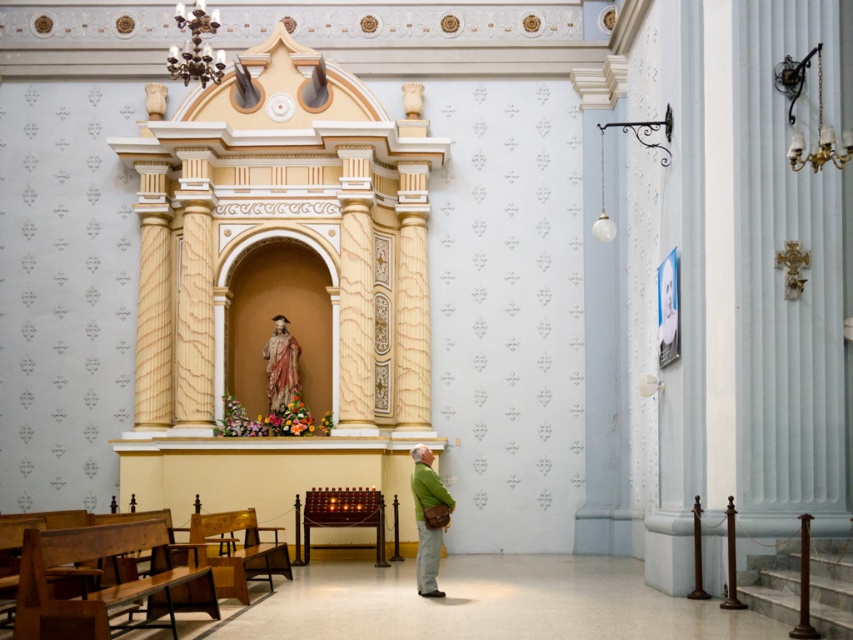
Question: Does wooden polished bench at lower left have a greater width compared to polychrome wood statue at center?

Choices:
 (A) yes
 (B) no

Answer: (A)

Question: Considering the relative positions of wooden polished bench at lower left and green fabric jacket at center in the image provided, where is wooden polished bench at lower left located with respect to green fabric jacket at center?

Choices:
 (A) left
 (B) right

Answer: (A)

Question: Which object is the closest to the green fabric jacket at center?

Choices:
 (A) wooden polished bench at lower left
 (B) polychrome wood statue at center

Answer: (A)

Question: Does wooden polished bench at lower left appear under green fabric jacket at center?

Choices:
 (A) no
 (B) yes

Answer: (B)

Question: Which point is closer to the camera?

Choices:
 (A) (424, 490)
 (B) (39, 582)
 (C) (283, 337)

Answer: (B)

Question: Based on their relative distances, which object is nearer to the green fabric jacket at center?

Choices:
 (A) polychrome wood statue at center
 (B) wooden polished bench at lower left

Answer: (B)